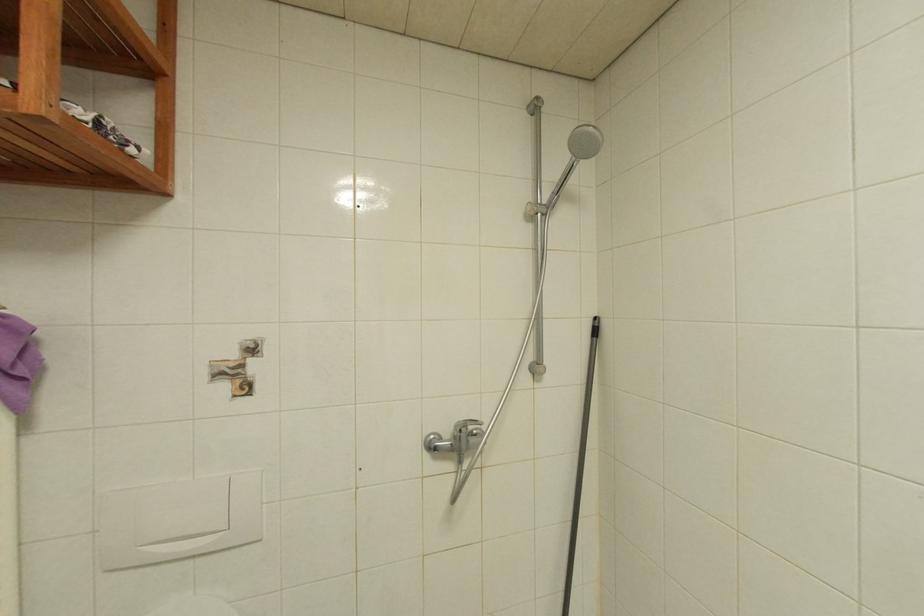
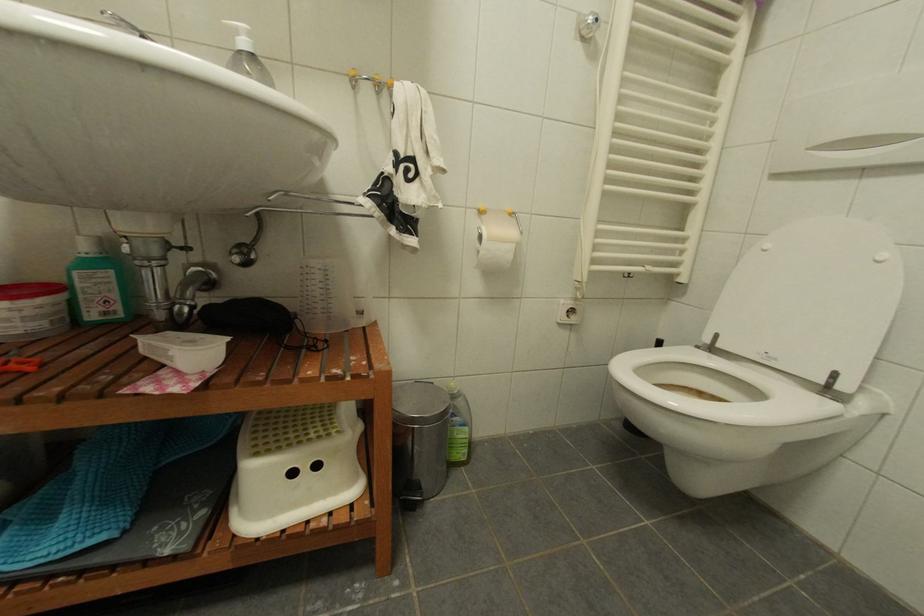
How did the camera likely rotate?

The camera's rotation is toward left-down.